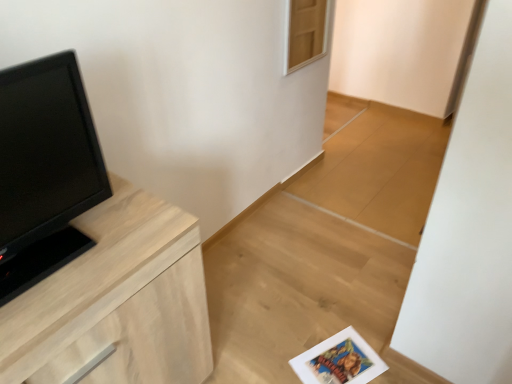
Question: Considering their positions, is light wood chest of drawers at left located in front of or behind black matte tv at left?

Choices:
 (A) behind
 (B) front

Answer: (A)

Question: Based on their positions, is light wood chest of drawers at left located to the left or right of black matte tv at left?

Choices:
 (A) left
 (B) right

Answer: (B)

Question: From a real-world perspective, relative to black matte tv at left, is light wood chest of drawers at left vertically above or below?

Choices:
 (A) above
 (B) below

Answer: (B)

Question: Is point (35, 238) closer or farther from the camera than point (75, 369)?

Choices:
 (A) closer
 (B) farther

Answer: (B)

Question: From a real-world perspective, is black matte tv at left physically located above or below light wood chest of drawers at left?

Choices:
 (A) below
 (B) above

Answer: (B)

Question: Is black matte tv at left inside the boundaries of light wood chest of drawers at left, or outside?

Choices:
 (A) outside
 (B) inside

Answer: (A)

Question: Is black matte tv at left bigger or smaller than light wood chest of drawers at left?

Choices:
 (A) small
 (B) big

Answer: (A)